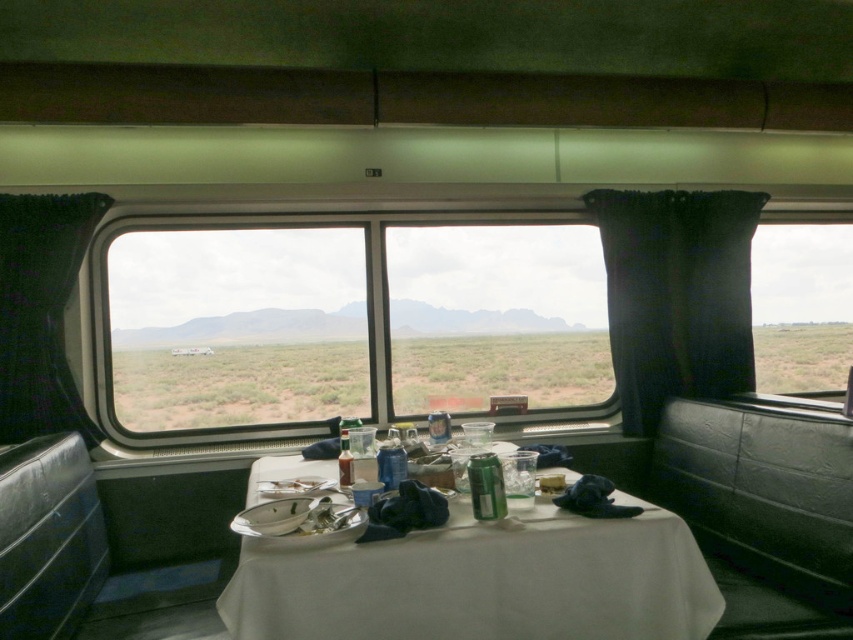
You are a passenger sitting in the train car and want to look outside through the clear glass window at center. However, the white cloth table at center is blocking your view. Can you determine if the window is taller than the table?

The clear glass window at center is taller than white cloth table at center, so yes, the window is taller than the table.

You are a passenger on the train and want to place a 1.5 foot wide book on the table. Is there enough space between the white cloth table at center and the nearest object to fit the book?

The objects on the white cloth table at center are 5.31 feet apart, so there is sufficient space to place a 1.5 foot wide book between them.